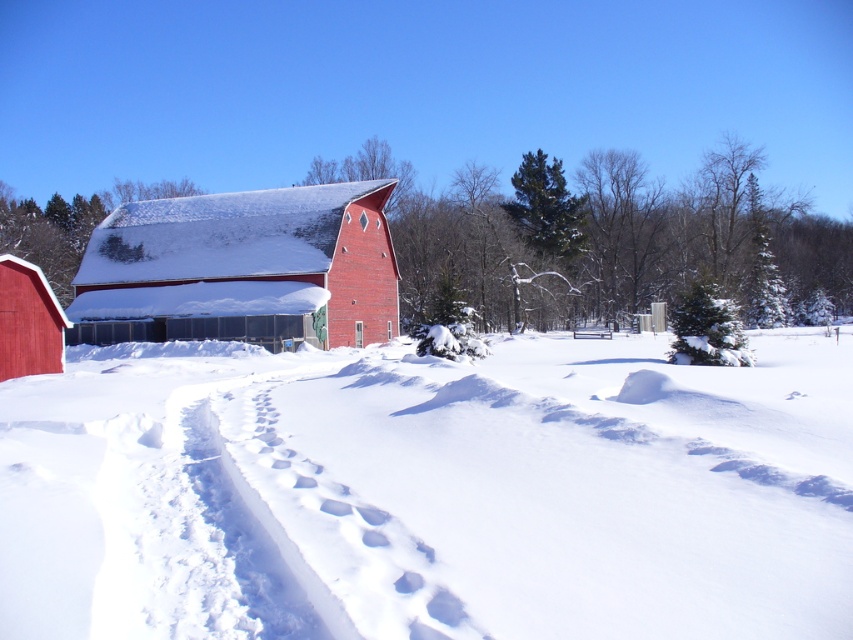
Question: Can you confirm if white fluffy snow at center is positioned to the right of matte red barn at center?

Choices:
 (A) no
 (B) yes

Answer: (B)

Question: Can you confirm if white fluffy snow at center is positioned above matte red barn at center?

Choices:
 (A) yes
 (B) no

Answer: (B)

Question: Estimate the real-world distances between objects in this image. Which object is closer to the matte red barn at lower left?

Choices:
 (A) white fluffy snow at center
 (B) matte red barn at center

Answer: (A)

Question: Is white fluffy snow at center positioned before matte red barn at lower left?

Choices:
 (A) yes
 (B) no

Answer: (A)

Question: Which point is farther to the camera?

Choices:
 (A) white fluffy snow at center
 (B) matte red barn at lower left

Answer: (B)

Question: Among these points, which one is farthest from the camera?

Choices:
 (A) (405, 508)
 (B) (48, 301)
 (C) (300, 316)

Answer: (C)